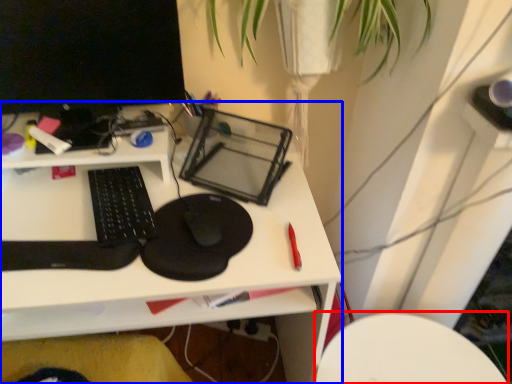
Question: Which point is closer to the camera, computer chair (highlighted by a red box) or desk (highlighted by a blue box)?

Choices:
 (A) computer chair
 (B) desk

Answer: (B)